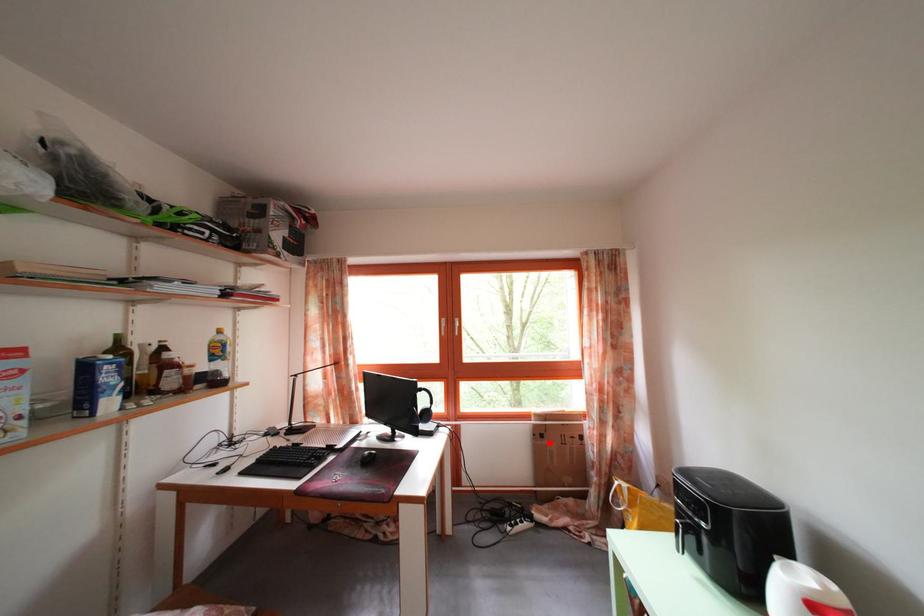
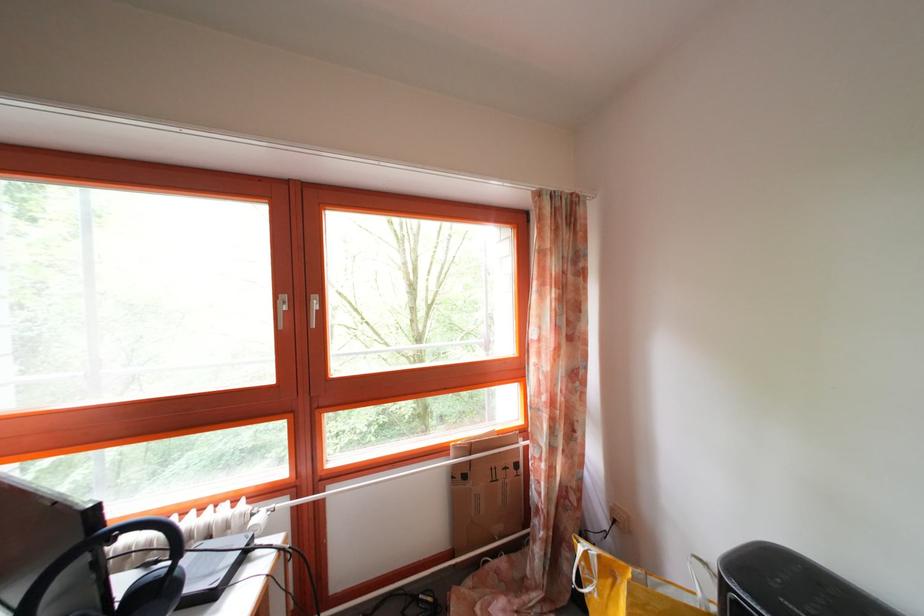
The point at the highlighted location is marked in the first image. Where is the corresponding point in the second image?

(472, 484)